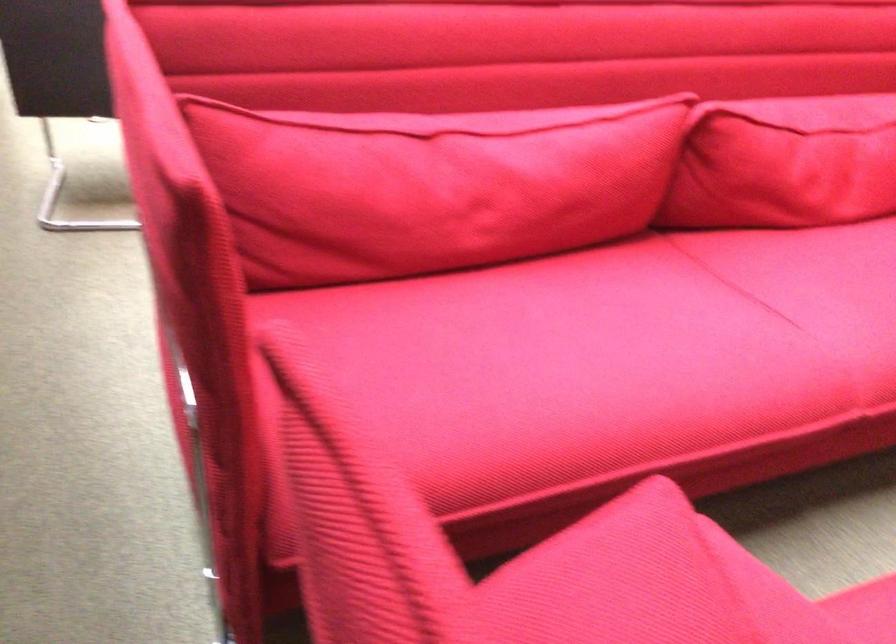
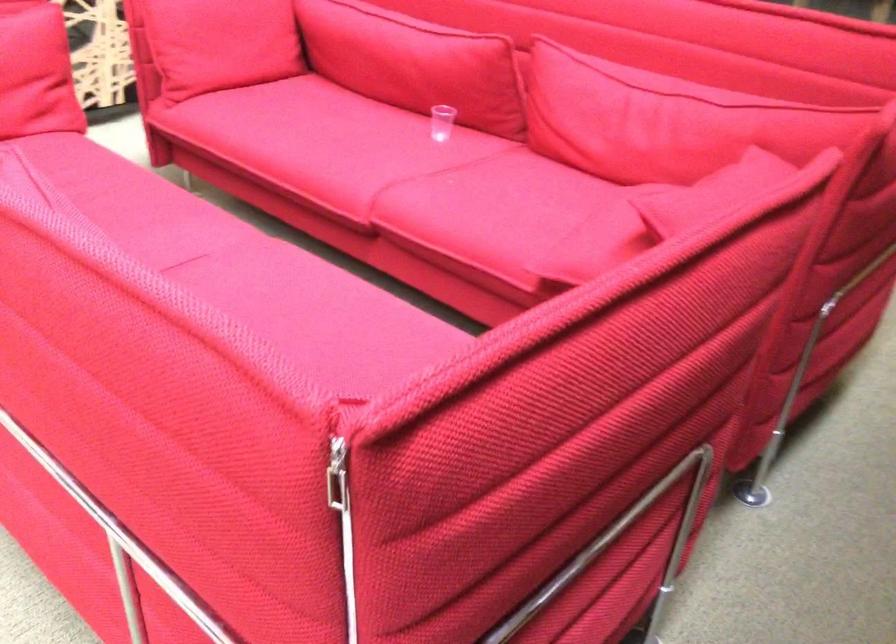
The point at (142, 77) is marked in the first image. Where is the corresponding point in the second image?

(691, 222)